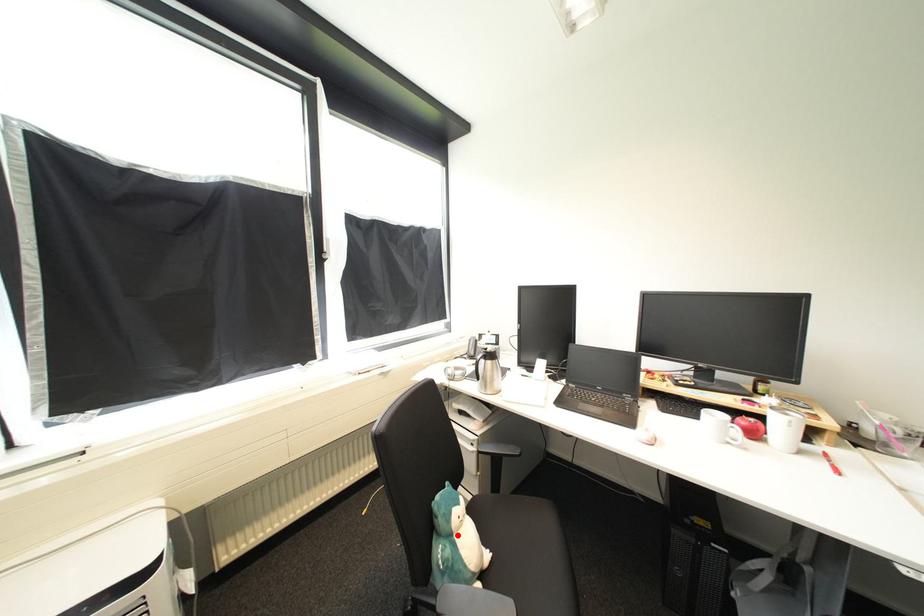
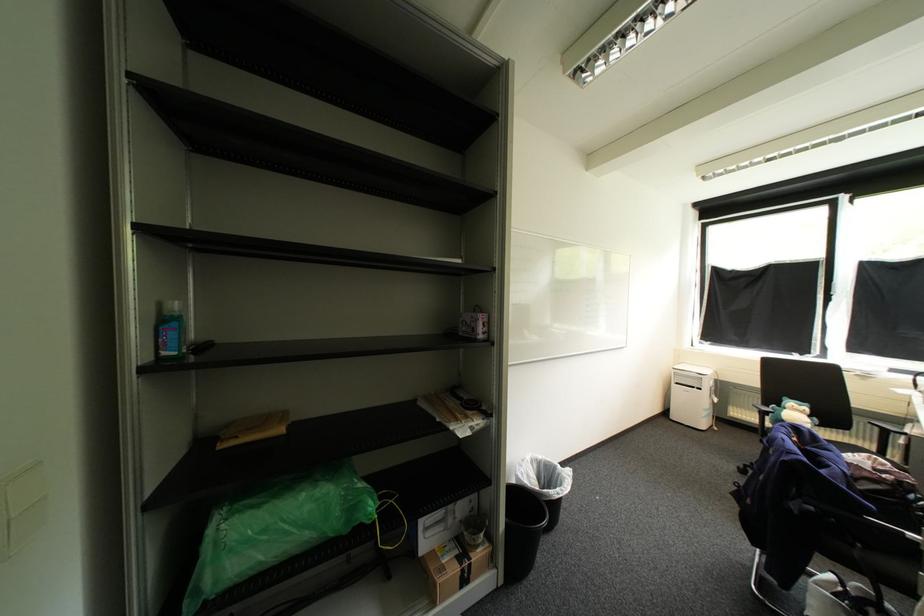
Question: A red point is marked in image1. In image2, is the corresponding 3D point closer to the camera or farther? Reply with the corresponding letter.

Choices:
 (A) The corresponding 3D point is closer.
 (B) The corresponding 3D point is farther.

Answer: (A)